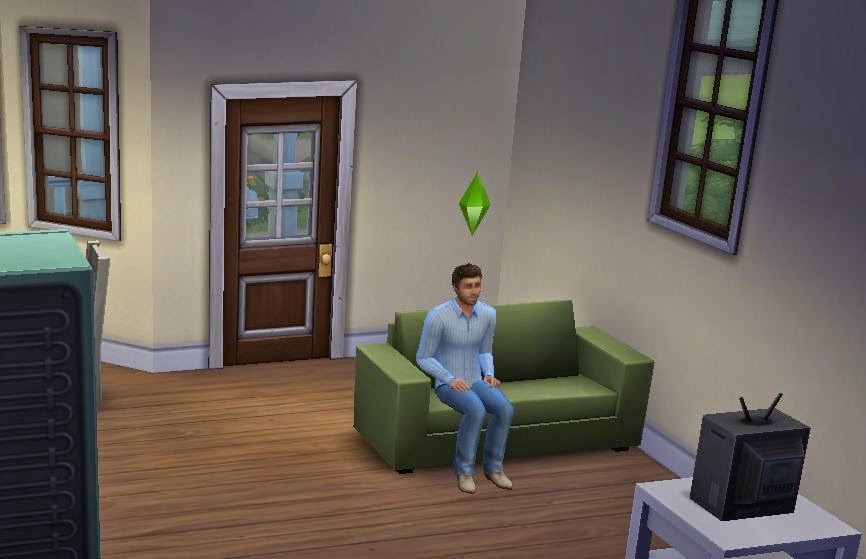
You are a GUI agent. You are given a task and a screenshot of the screen. Output one action in this format:
    pyautogui.click(x=<x>, y=<y>)
    Task: Click on the couch
    This screenshot has width=866, height=559.
    Given the screenshot: What is the action you would take?
    pyautogui.click(x=551, y=383)